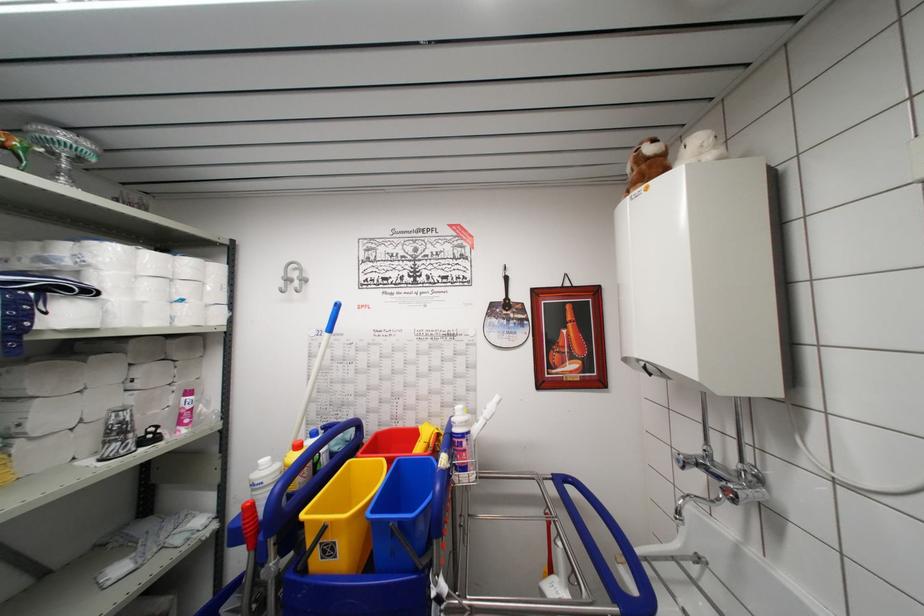
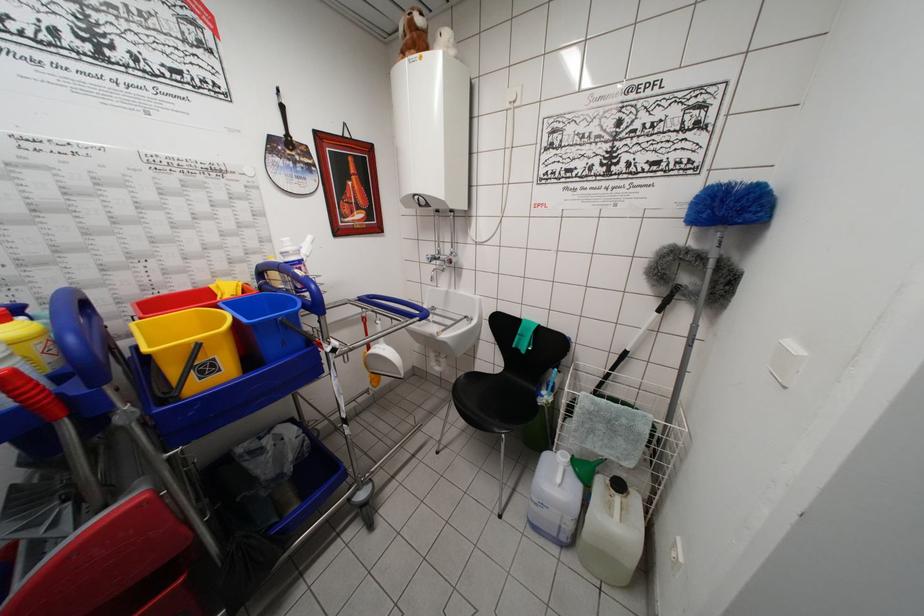
Where in the second image is the point corresponding to point 555,479 from the first image?

(360, 302)